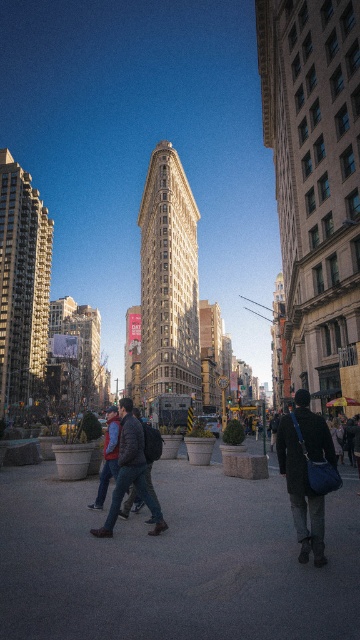
You are observing a person standing in the center of the scene. You notice two items on them. Which item is taller between the matte black jacket at center and the dark blue jeans at center?

The matte black jacket at center is taller than the dark blue jeans at center.